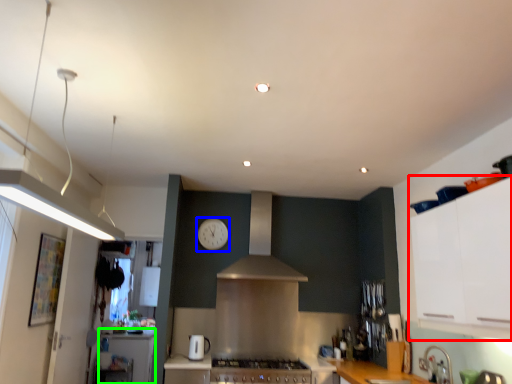
Question: Which object is the farthest from cabinetry (highlighted by a red box)? Choose among these: clock (highlighted by a blue box) or counter top (highlighted by a green box).

Choices:
 (A) clock
 (B) counter top

Answer: (B)